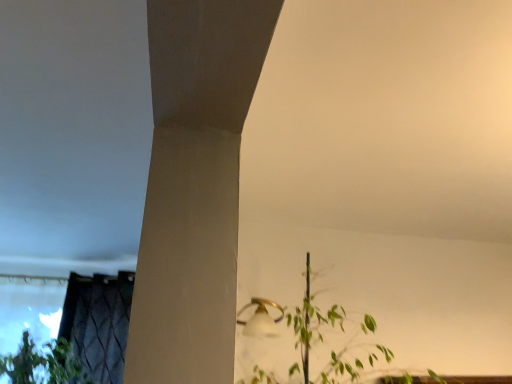
At what (x,y) coordinates should I click in order to perform the action: click on transparent glass door at lower left. Please return your answer as a coordinate pair (x, y). Looking at the image, I should click on (99, 322).

Describe the element at coordinates (99, 322) in the screenshot. I see `transparent glass door at lower left` at that location.

The image size is (512, 384). Identify the location of transparent glass door at lower left. (99, 322).